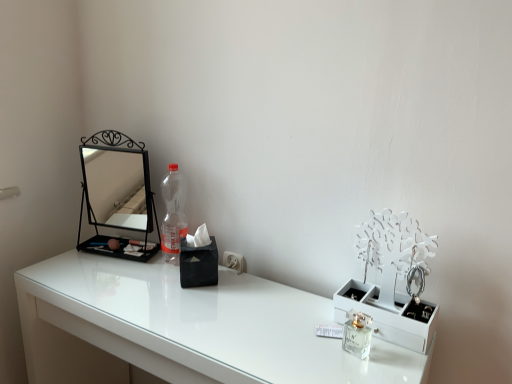
Locate an element on the screen. This screenshot has width=512, height=384. white glossy table at center is located at coordinates (185, 328).

The width and height of the screenshot is (512, 384). What are the coordinates of `clear glass perfume at center` in the screenshot? It's located at point(357,334).

Which of these two, clear glass perfume at center or black metal mirror at left, stands taller?

black metal mirror at left.

From the image's perspective, is clear glass perfume at center on top of black metal mirror at left?

No, from the image's perspective, clear glass perfume at center is not above black metal mirror at left.

Does clear glass perfume at center come behind black metal mirror at left?

No, clear glass perfume at center is closer to the camera.

Would you say white glossy table at center is to the left or to the right of black metal mirror at left in the picture?

Clearly, white glossy table at center is on the right of black metal mirror at left in the image.

Is white glossy table at center next to black metal mirror at left?

No.

Is white glossy table at center facing towards black metal mirror at left?

No, white glossy table at center does not turn towards black metal mirror at left.

Where is `table to the right of black metal mirror at left`? The width and height of the screenshot is (512, 384). table to the right of black metal mirror at left is located at coordinates 185,328.

Could you tell me if black metal mirror at left is facing clear glass perfume at center?

No, black metal mirror at left is not facing towards clear glass perfume at center.

Can you confirm if black metal mirror at left is wider than clear glass perfume at center?

Correct, the width of black metal mirror at left exceeds that of clear glass perfume at center.

Is black metal mirror at left inside the boundaries of clear glass perfume at center, or outside?

black metal mirror at left exists outside the volume of clear glass perfume at center.

Based on the photo, from a real-world perspective, is black metal mirror at left physically below clear glass perfume at center?

Actually, black metal mirror at left is physically above clear glass perfume at center in the real world.

Is white glossy table at center at the left side of clear glass perfume at center?

Correct, you'll find white glossy table at center to the left of clear glass perfume at center.

Would you consider white glossy table at center to be distant from clear glass perfume at center?

They are positioned close to each other.

Is white glossy table at center positioned beyond the bounds of clear glass perfume at center?

Absolutely, white glossy table at center is external to clear glass perfume at center.

This screenshot has height=384, width=512. Find the location of `perfume above the white glossy table at center (from a real-world perspective)`. perfume above the white glossy table at center (from a real-world perspective) is located at coordinates (357, 334).

How far apart are black metal mirror at left and white glossy table at center?

black metal mirror at left is 18.25 inches away from white glossy table at center.

Based on the photo, who is bigger, black metal mirror at left or white glossy table at center?

With larger size is white glossy table at center.

Find the location of a particular element. table in front of the black metal mirror at left is located at coordinates (185, 328).

Is black metal mirror at left wider than white glossy table at center?

No.

In the scene shown: Is clear glass perfume at center touching white glossy table at center?

They are not placed beside each other.

Considering their positions, is clear glass perfume at center located in front of or behind white glossy table at center?

Visually, clear glass perfume at center is located behind white glossy table at center.

Between clear glass perfume at center and white glossy table at center, which one appears on the left side from the viewer's perspective?

From the viewer's perspective, white glossy table at center appears more on the left side.

At what (x,y) coordinates should I click in order to perform the action: click on medicine cabinet that is above the clear glass perfume at center (from a real-world perspective). Please return your answer as a coordinate pair (x, y). Looking at the image, I should click on (117, 194).

I want to click on table directly beneath the black metal mirror at left (from a real-world perspective), so click(185, 328).

From the image, which object appears to be farther from clear glass perfume at center, white glossy table at center or black metal mirror at left?

Based on the image, black metal mirror at left appears to be further to clear glass perfume at center.

When comparing their distances from clear glass perfume at center, does black metal mirror at left or white glossy table at center seem closer?

white glossy table at center is closer to clear glass perfume at center.

Estimate the real-world distances between objects in this image. Which object is closer to black metal mirror at left, white glossy table at center or clear glass perfume at center?

white glossy table at center.

Considering their positions, is clear glass perfume at center positioned closer to black metal mirror at left than white glossy table at center?

The object closer to black metal mirror at left is white glossy table at center.

Looking at this image, based on their spatial positions, is clear glass perfume at center or black metal mirror at left further from white glossy table at center?

Among the two, clear glass perfume at center is located further to white glossy table at center.

Looking at the image, which one is located further to white glossy table at center, black metal mirror at left or clear glass perfume at center?

clear glass perfume at center.

This screenshot has width=512, height=384. I want to click on table between black metal mirror at left and clear glass perfume at center from left to right, so click(185, 328).